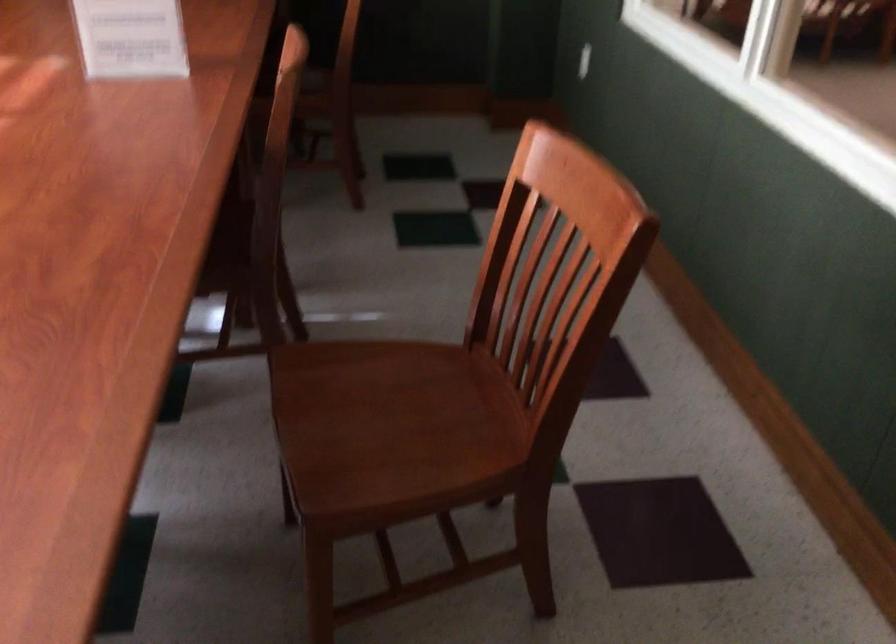
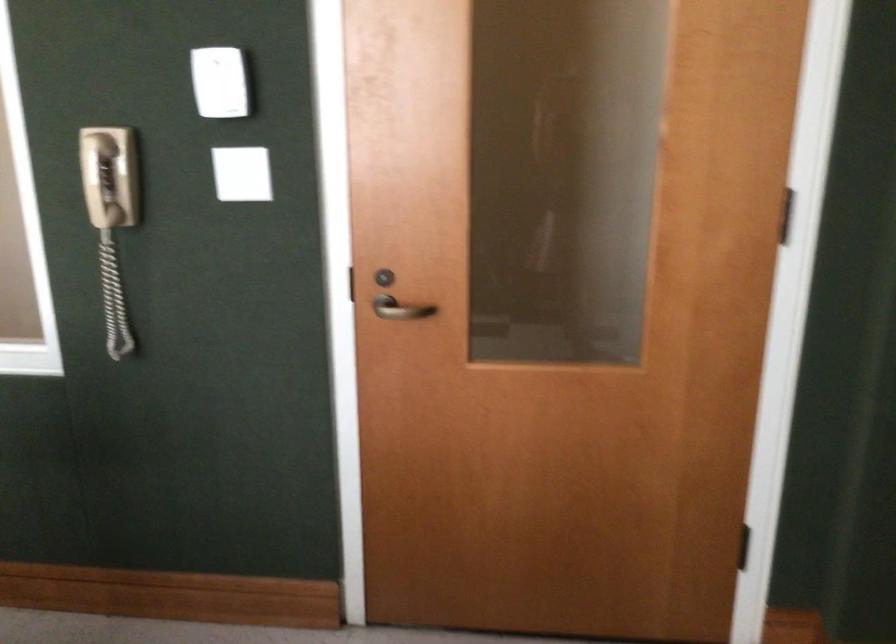
Question: The first image is from the beginning of the video and the second image is from the end. How did the camera likely rotate when shooting the video?

Choices:
 (A) Left
 (B) Right
 (C) Up
 (D) Down

Answer: (B)